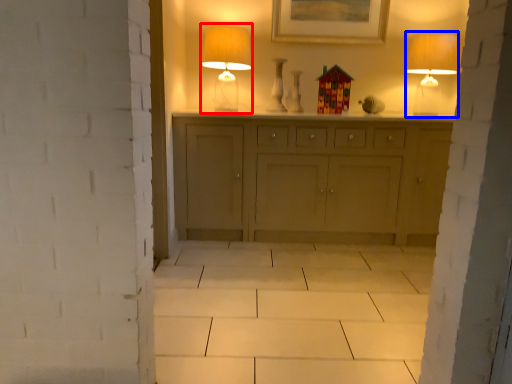
Question: Which point is further to the camera, table lamp (highlighted by a red box) or table lamp (highlighted by a blue box)?

Choices:
 (A) table lamp
 (B) table lamp

Answer: (B)